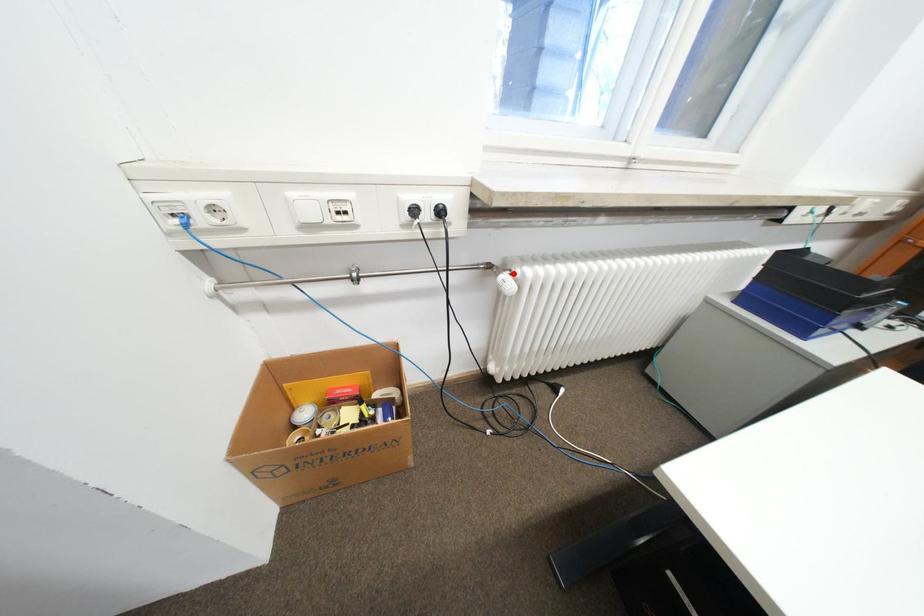
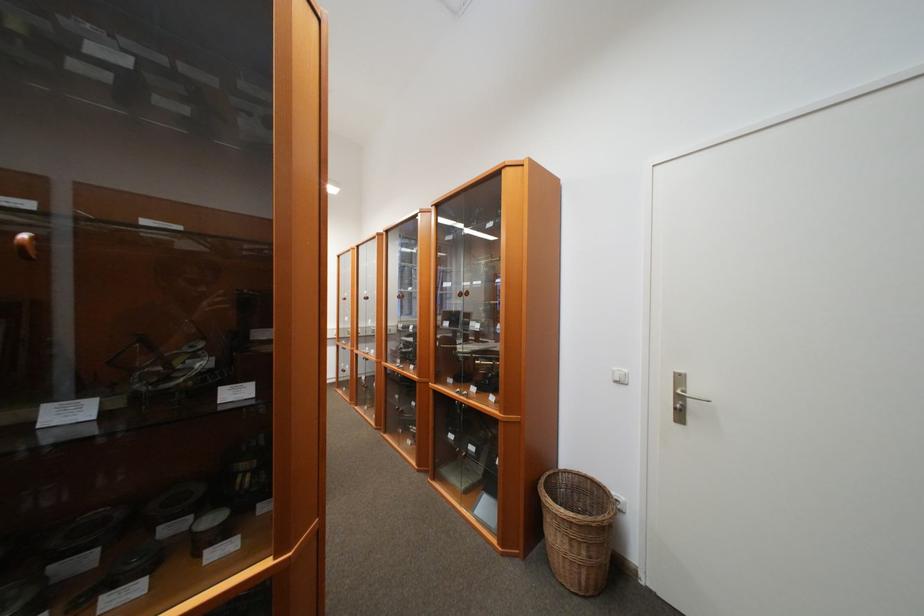
Question: I am providing you with two images of the same scene from different viewpoints. A red point is marked on the first image. Can you still see the location of the red point in image 2?

Choices:
 (A) Yes
 (B) No

Answer: (B)